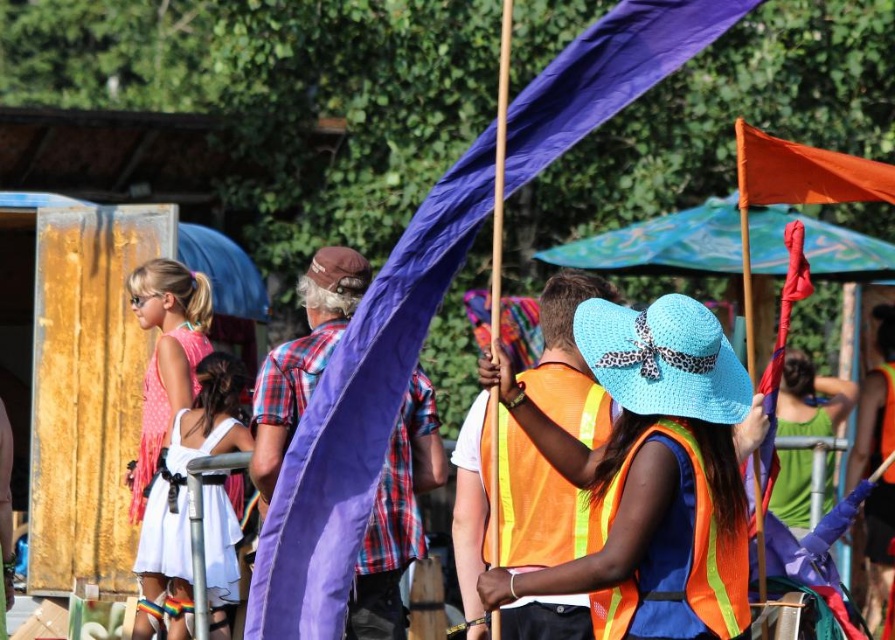
Does neon orange safety vest at center have a greater width compared to white satin dress at lower left?

No, neon orange safety vest at center is not wider than white satin dress at lower left.

Between point (729, 528) and point (137, 608), which one is positioned behind?

The point (137, 608) is more distant.

Where is `neon orange safety vest at center`? neon orange safety vest at center is located at coordinates (675, 552).

Is orange reflective vest at center wider than neon orange safety vest at center?

Correct, the width of orange reflective vest at center exceeds that of neon orange safety vest at center.

Does orange reflective vest at center have a greater height compared to neon orange safety vest at center?

Yes, orange reflective vest at center is taller than neon orange safety vest at center.

The image size is (895, 640). What do you see at coordinates (535, 504) in the screenshot?
I see `orange reflective vest at center` at bounding box center [535, 504].

You are a GUI agent. You are given a task and a screenshot of the screen. Output one action in this format:
    pyautogui.click(x=<x>, y=<y>)
    Task: Click on the orange reflective vest at center
    The image size is (895, 640).
    Given the screenshot: What is the action you would take?
    pyautogui.click(x=535, y=504)

Between point (483, 600) and point (716, 220), which one is positioned behind?

Positioned behind is point (716, 220).

Is blue woven hat at center above orange fabric canopy at upper right?

Incorrect, blue woven hat at center is not positioned above orange fabric canopy at upper right.

This screenshot has height=640, width=895. Describe the element at coordinates (649, 476) in the screenshot. I see `blue woven hat at center` at that location.

This screenshot has width=895, height=640. I want to click on blue woven hat at center, so click(649, 476).